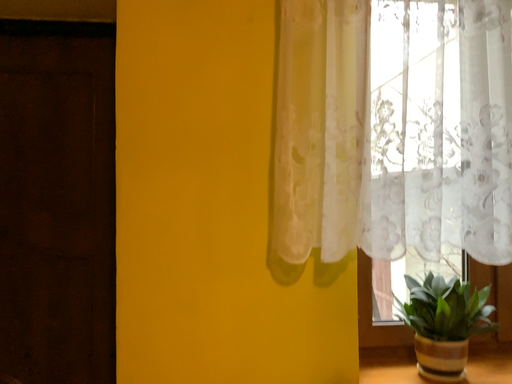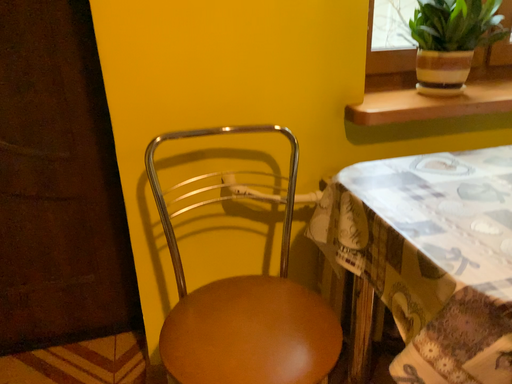
Question: Which way did the camera rotate in the video?

Choices:
 (A) rotated left
 (B) rotated right

Answer: (B)